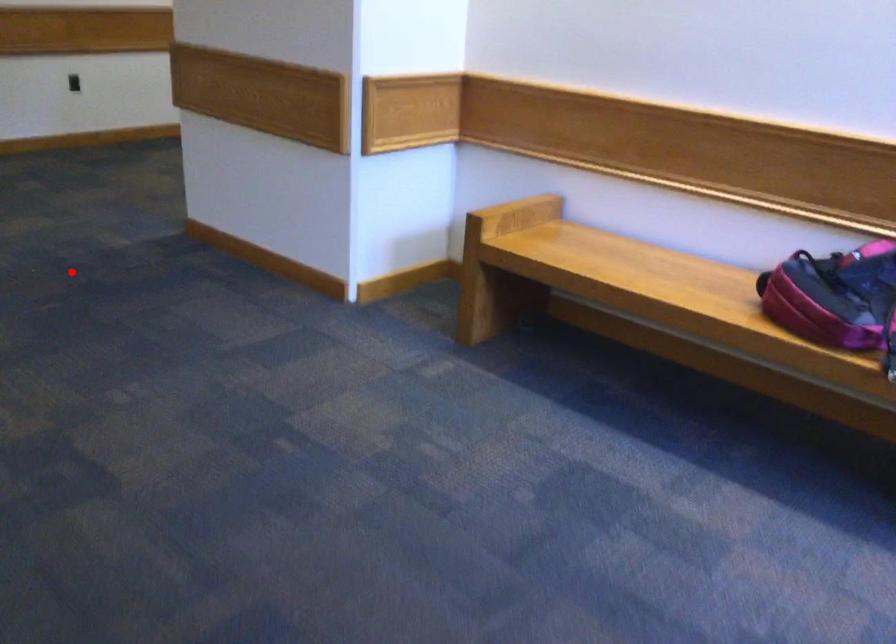
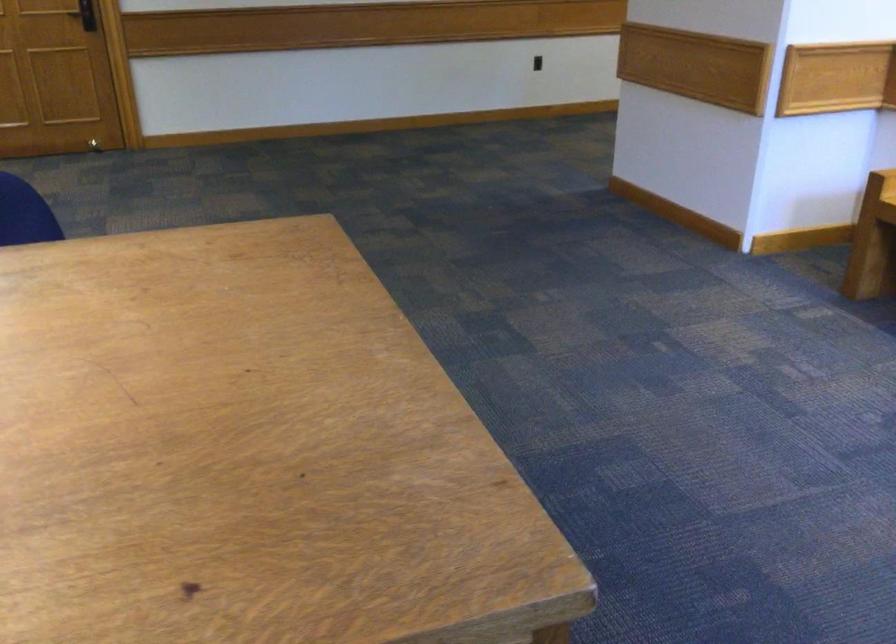
Question: I am providing you with two images of the same scene from different viewpoints. A red point is shown in image1. For the corresponding object point in image2, is it positioned nearer or farther from the camera?

Choices:
 (A) Nearer
 (B) Farther

Answer: (B)